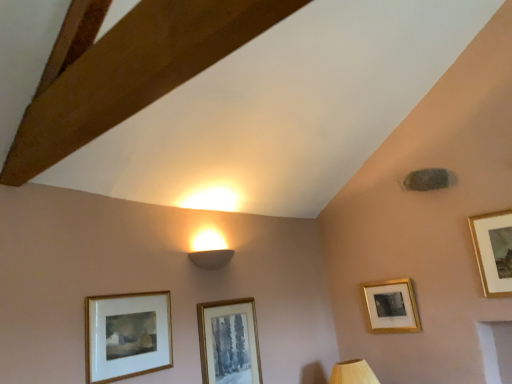
Question: Is gold-framed picture at upper right, marked as the 2th picture frame in a back-to-front arrangement, positioned before matte gold picture frame at center, which appears as the 3th picture frame when viewed from the right?

Choices:
 (A) yes
 (B) no

Answer: (B)

Question: Does gold-framed picture at upper right, the fourth picture frame viewed from the left, turn towards matte gold picture frame at center, placed as the second picture frame when sorted from front to back?

Choices:
 (A) no
 (B) yes

Answer: (A)

Question: From the image's perspective, does gold-framed picture at upper right, the fourth picture frame viewed from the left, appear higher than matte gold picture frame at center, which appears as the 3th picture frame when viewed from the right?

Choices:
 (A) no
 (B) yes

Answer: (B)

Question: Is gold-framed picture at upper right, which is the third picture frame in front-to-back order, to the right of matte gold picture frame at center, the 2th picture frame positioned from the left, from the viewer's perspective?

Choices:
 (A) yes
 (B) no

Answer: (A)

Question: From a real-world perspective, is gold-framed picture at upper right, the fourth picture frame viewed from the left, physically above matte gold picture frame at center, which appears as the 3th picture frame when viewed from the right?

Choices:
 (A) no
 (B) yes

Answer: (B)

Question: Is matte gold picture frame at center, placed as the second picture frame when sorted from front to back, in front of or behind gold-framed picture at upper right, which is the third picture frame in front-to-back order, in the image?

Choices:
 (A) behind
 (B) front

Answer: (B)

Question: Is point (241, 319) closer or farther from the camera than point (479, 221)?

Choices:
 (A) closer
 (B) farther

Answer: (A)

Question: From a real-world perspective, relative to gold-framed picture at upper right, which ranks as the 1th picture frame in right-to-left order, is matte gold picture frame at center, which is counted as the third picture frame, starting from the back, vertically above or below?

Choices:
 (A) below
 (B) above

Answer: (A)

Question: From their relative heights in the image, would you say matte gold picture frame at center, which is counted as the third picture frame, starting from the back, is taller or shorter than gold-framed picture at upper right, marked as the 2th picture frame in a back-to-front arrangement?

Choices:
 (A) tall
 (B) short

Answer: (A)

Question: Is gold-framed picture at lower right, the 3th picture frame in the left-to-right sequence, inside the boundaries of matte gold picture frame at center, placed as the second picture frame when sorted from front to back, or outside?

Choices:
 (A) inside
 (B) outside

Answer: (B)

Question: Considering the positions of gold-framed picture at lower right, the 2th picture frame viewed from the right, and matte gold picture frame at center, which appears as the 3th picture frame when viewed from the right, in the image, is gold-framed picture at lower right, the 2th picture frame viewed from the right, wider or thinner than matte gold picture frame at center, which appears as the 3th picture frame when viewed from the right,?

Choices:
 (A) wide
 (B) thin

Answer: (B)

Question: From the image's perspective, is gold-framed picture at lower right, the 2th picture frame viewed from the right, above or below matte gold picture frame at center, which is counted as the third picture frame, starting from the back?

Choices:
 (A) below
 (B) above

Answer: (B)

Question: Is point (403, 291) closer or farther from the camera than point (216, 339)?

Choices:
 (A) farther
 (B) closer

Answer: (A)

Question: From a real-world perspective, is white matte wall sconce at upper center above or below wooden at lower right?

Choices:
 (A) below
 (B) above

Answer: (B)

Question: Is white matte wall sconce at upper center inside or outside of wooden at lower right?

Choices:
 (A) inside
 (B) outside

Answer: (B)